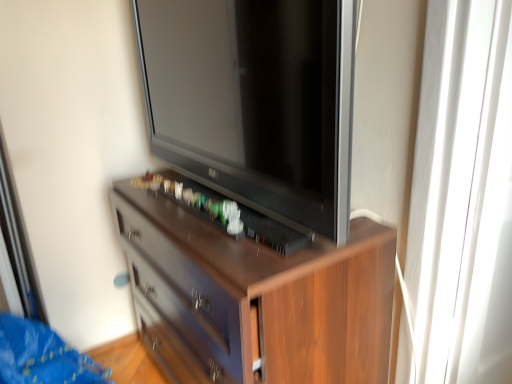
Identify the location of satin black television at center. This screenshot has height=384, width=512. (255, 101).

Based on the photo, from the image's perspective, is brown wood chest of drawers at center above or below transparent glass door at right?

From the image's perspective, brown wood chest of drawers at center appears below transparent glass door at right.

Is point (364, 301) more distant than point (448, 165)?

Yes, point (364, 301) is behind point (448, 165).

Could you tell me if brown wood chest of drawers at center is facing transparent glass door at right?

No, brown wood chest of drawers at center is not turned towards transparent glass door at right.

Is brown wood chest of drawers at center positioned far away from transparent glass door at right?

No.

Locate an element on the screen. The width and height of the screenshot is (512, 384). glass door beneath the satin black television at center (from a real-world perspective) is located at coordinates [x=461, y=202].

Is satin black television at center completely or partially inside transparent glass door at right?

No, satin black television at center is not a part of transparent glass door at right.

Which of these two, transparent glass door at right or satin black television at center, is smaller?

Smaller between the two is transparent glass door at right.

Considering the relative sizes of satin black television at center and transparent glass door at right in the image provided, is satin black television at center bigger than transparent glass door at right?

Yes, satin black television at center is bigger than transparent glass door at right.

Which object is further away from the camera taking this photo, satin black television at center or transparent glass door at right?

transparent glass door at right.

Is satin black television at center turned away from transparent glass door at right?

Yes, satin black television at center is facing away from transparent glass door at right.

Considering the sizes of objects satin black television at center and transparent glass door at right in the image provided, who is taller, satin black television at center or transparent glass door at right?

Standing taller between the two is transparent glass door at right.

From the image's perspective, which object appears higher, brown wood chest of drawers at center or satin black television at center?

satin black television at center appears higher in the image.

Does brown wood chest of drawers at center have a smaller size compared to satin black television at center?

Actually, brown wood chest of drawers at center might be larger than satin black television at center.

Is brown wood chest of drawers at center turned away from satin black television at center?

No, satin black television at center is not at the back of brown wood chest of drawers at center.

Where is `television above the brown wood chest of drawers at center (from the image's perspective)`? television above the brown wood chest of drawers at center (from the image's perspective) is located at coordinates (255, 101).

At what (x,y) coordinates should I click in order to perform the action: click on television above the brown wood chest of drawers at center (from a real-world perspective). Please return your answer as a coordinate pair (x, y). This screenshot has width=512, height=384. Looking at the image, I should click on (255, 101).

Is the depth of satin black television at center greater than that of brown wood chest of drawers at center?

No, satin black television at center is closer to the viewer.

Between satin black television at center and brown wood chest of drawers at center, which one has less height?

satin black television at center is shorter.

Can you tell me how much satin black television at center and brown wood chest of drawers at center differ in facing direction?

The angle between the facing direction of satin black television at center and the facing direction of brown wood chest of drawers at center is 1.11 degrees.

Would you say transparent glass door at right is a long distance from brown wood chest of drawers at center?

No, there isn't a large distance between transparent glass door at right and brown wood chest of drawers at center.

Which point is more forward, (508, 299) or (369, 300)?

Point (369, 300)

From the image's perspective, which one is positioned higher, transparent glass door at right or brown wood chest of drawers at center?

From the image's view, transparent glass door at right is above.

Is transparent glass door at right inside or outside of brown wood chest of drawers at center?

transparent glass door at right is outside brown wood chest of drawers at center.

Locate an element on the screen. The height and width of the screenshot is (384, 512). chest of drawers in front of the transparent glass door at right is located at coordinates (255, 298).

This screenshot has width=512, height=384. In order to click on television on the left side of transparent glass door at right in this screenshot , I will do `click(255, 101)`.

When comparing their distances from satin black television at center, does transparent glass door at right or brown wood chest of drawers at center seem further?

transparent glass door at right.

Estimate the real-world distances between objects in this image. Which object is further from satin black television at center, brown wood chest of drawers at center or transparent glass door at right?

transparent glass door at right lies further to satin black television at center than the other object.

Estimate the real-world distances between objects in this image. Which object is further from transparent glass door at right, brown wood chest of drawers at center or satin black television at center?

The object further to transparent glass door at right is satin black television at center.

Estimate the real-world distances between objects in this image. Which object is closer to brown wood chest of drawers at center, satin black television at center or transparent glass door at right?

Based on the image, satin black television at center appears to be nearer to brown wood chest of drawers at center.

Estimate the real-world distances between objects in this image. Which object is closer to brown wood chest of drawers at center, transparent glass door at right or satin black television at center?

satin black television at center lies closer to brown wood chest of drawers at center than the other object.

Looking at the image, which one is located further to transparent glass door at right, satin black television at center or brown wood chest of drawers at center?

satin black television at center lies further to transparent glass door at right than the other object.

Image resolution: width=512 pixels, height=384 pixels. What are the coordinates of `the chest of drawers situated between satin black television at center and transparent glass door at right from left to right` in the screenshot? It's located at (255, 298).